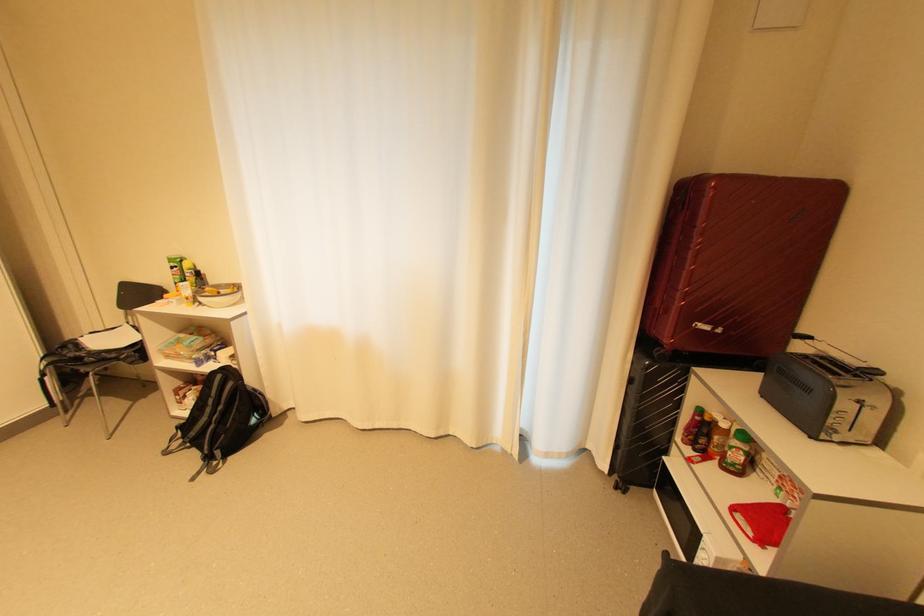
Find the location of a particular element. black backpack is located at coordinates (220, 419).